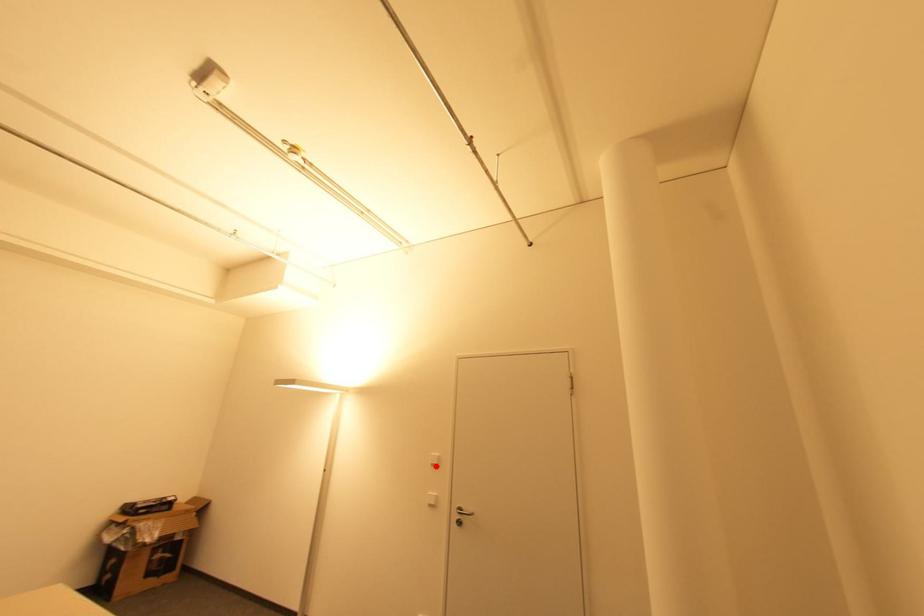
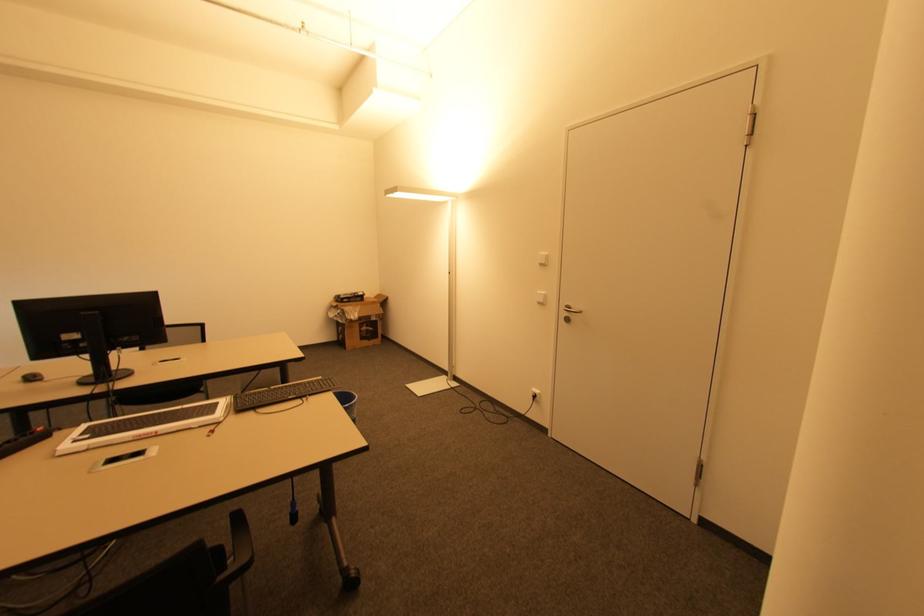
Where in the second image is the point corresponding to the highlighted location from the first image?

(542, 265)